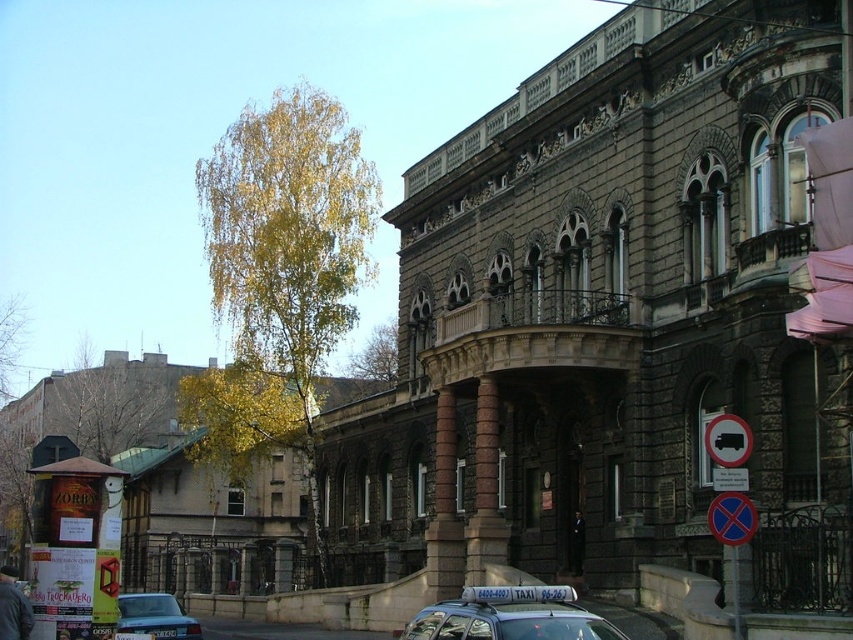
Question: Does yellow-green leaves at upper left appear on the left side of blue plastic sign at lower right?

Choices:
 (A) no
 (B) yes

Answer: (B)

Question: Can you confirm if metallic silver taxi at center is positioned above white plastic bus at upper right?

Choices:
 (A) no
 (B) yes

Answer: (A)

Question: Which of the following is the farthest from the observer?

Choices:
 (A) (152, 400)
 (B) (711, 442)
 (C) (134, 593)

Answer: (A)

Question: Considering the real-world distances, which object is farthest from the white plastic bus at upper right?

Choices:
 (A) yellow-green leaves at upper left
 (B) yellow leafy tree at upper left
 (C) blue plastic sign at lower right

Answer: (B)

Question: Is yellow-green leaves at left bigger than blue plastic sign at lower right?

Choices:
 (A) no
 (B) yes

Answer: (B)

Question: Which object is positioned closest to the blue metallic taxi at center?

Choices:
 (A) yellow leafy tree at upper left
 (B) yellow-green leaves at upper left
 (C) metallic silver taxi at center

Answer: (C)